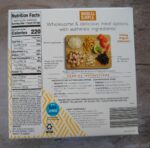
Identify the location of brown cutting board on top right of center package back. (108, 66).